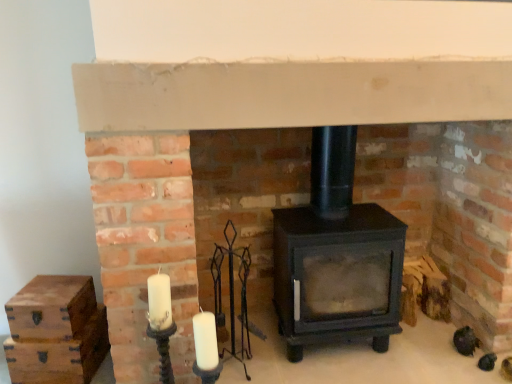
Question: Is wooden chest at lower left, which appears as the first drawer when ordered from the bottom, aimed at matte black wood burning stove at center?

Choices:
 (A) no
 (B) yes

Answer: (A)

Question: Considering the relative sizes of wooden chest at lower left, the 2th drawer from the top, and matte black wood burning stove at center in the image provided, is wooden chest at lower left, the 2th drawer from the top, thinner than matte black wood burning stove at center?

Choices:
 (A) no
 (B) yes

Answer: (B)

Question: From the image's perspective, does wooden chest at lower left, which appears as the first drawer when ordered from the bottom, appear lower than matte black wood burning stove at center?

Choices:
 (A) yes
 (B) no

Answer: (A)

Question: From a real-world perspective, does wooden chest at lower left, the 2th drawer from the top, sit lower than matte black wood burning stove at center?

Choices:
 (A) yes
 (B) no

Answer: (A)

Question: From a real-world perspective, is wooden chest at lower left, which appears as the first drawer when ordered from the bottom, positioned over matte black wood burning stove at center based on gravity?

Choices:
 (A) no
 (B) yes

Answer: (A)

Question: Does wooden chest at lower left, the 2th drawer from the top, come in front of matte black wood burning stove at center?

Choices:
 (A) no
 (B) yes

Answer: (A)

Question: Can you confirm if wooden chest at left, arranged as the 1th drawer when viewed from the top, is wider than matte black wood burning stove at center?

Choices:
 (A) yes
 (B) no

Answer: (B)

Question: Could you tell me if wooden chest at left, the second drawer when ordered from bottom to top, is turned towards matte black wood burning stove at center?

Choices:
 (A) no
 (B) yes

Answer: (A)

Question: From the image's perspective, is wooden chest at left, arranged as the 1th drawer when viewed from the top, above matte black wood burning stove at center?

Choices:
 (A) yes
 (B) no

Answer: (B)

Question: Is wooden chest at left, the second drawer when ordered from bottom to top, positioned behind matte black wood burning stove at center?

Choices:
 (A) no
 (B) yes

Answer: (B)

Question: Can you confirm if wooden chest at left, the second drawer when ordered from bottom to top, is taller than matte black wood burning stove at center?

Choices:
 (A) no
 (B) yes

Answer: (A)

Question: From the image's perspective, is wooden chest at left, the second drawer when ordered from bottom to top, located beneath matte black wood burning stove at center?

Choices:
 (A) yes
 (B) no

Answer: (A)

Question: Can you confirm if wooden chest at left, arranged as the 1th drawer when viewed from the top, is bigger than wooden chest at lower left, the 2th drawer from the top?

Choices:
 (A) no
 (B) yes

Answer: (A)